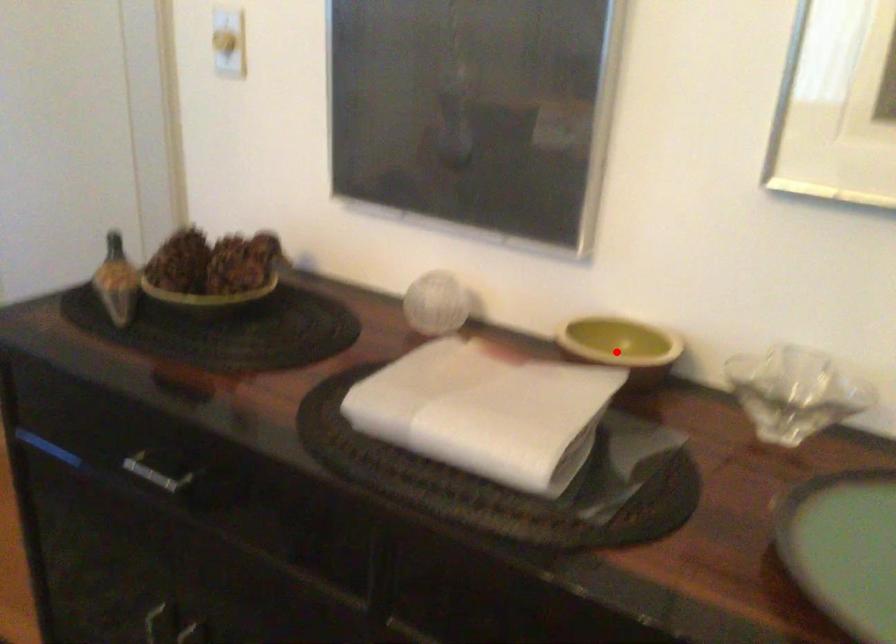
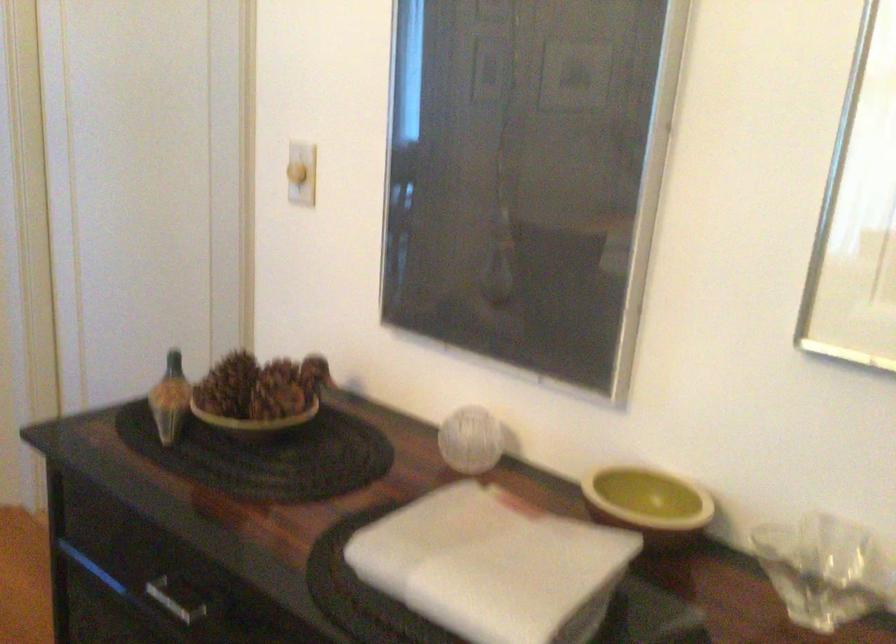
Locate, in the second image, the point that corresponds to the highlighted location in the first image.

(648, 503)